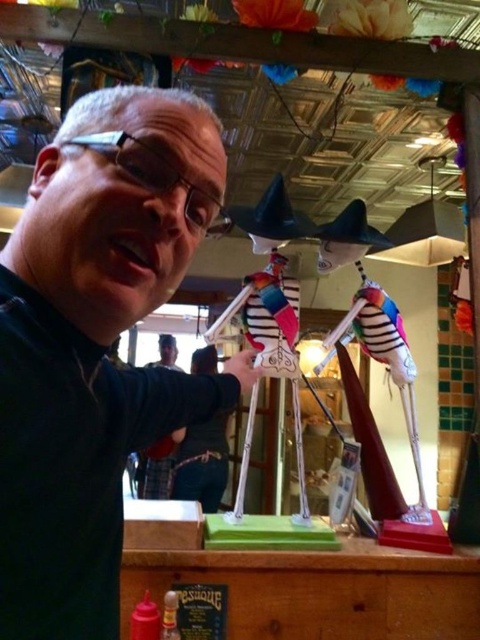
Is black matte man at center bigger than dark blue uniform at center?

Yes, black matte man at center is bigger than dark blue uniform at center.

Between black matte man at center and dark blue uniform at center, which one has more height?

black matte man at center is taller.

The image size is (480, 640). In order to click on black matte man at center in this screenshot , I will do `click(96, 344)`.

The image size is (480, 640). What are the coordinates of `black matte man at center` in the screenshot? It's located at (96, 344).